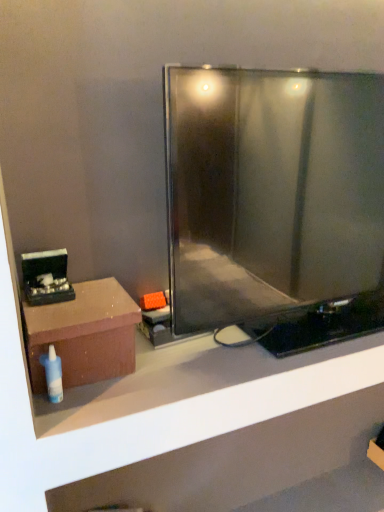
Question: Is point (87, 290) closer or farther from the camera than point (59, 362)?

Choices:
 (A) closer
 (B) farther

Answer: (B)

Question: Visually, is matte brown box at left positioned to the left or to the right of white plastic bottle at lower left?

Choices:
 (A) left
 (B) right

Answer: (B)

Question: Estimate the real-world distances between objects in this image. Which object is closer to the matte brown box at left?

Choices:
 (A) black glossy jewelry box at left
 (B) white plastic bottle at lower left
 (C) brown matte shelf at lower left
 (D) metallic flat-screen tv at center

Answer: (B)

Question: Considering the real-world distances, which object is farthest from the white plastic bottle at lower left?

Choices:
 (A) brown matte shelf at lower left
 (B) matte brown box at left
 (C) metallic flat-screen tv at center
 (D) black glossy jewelry box at left

Answer: (A)